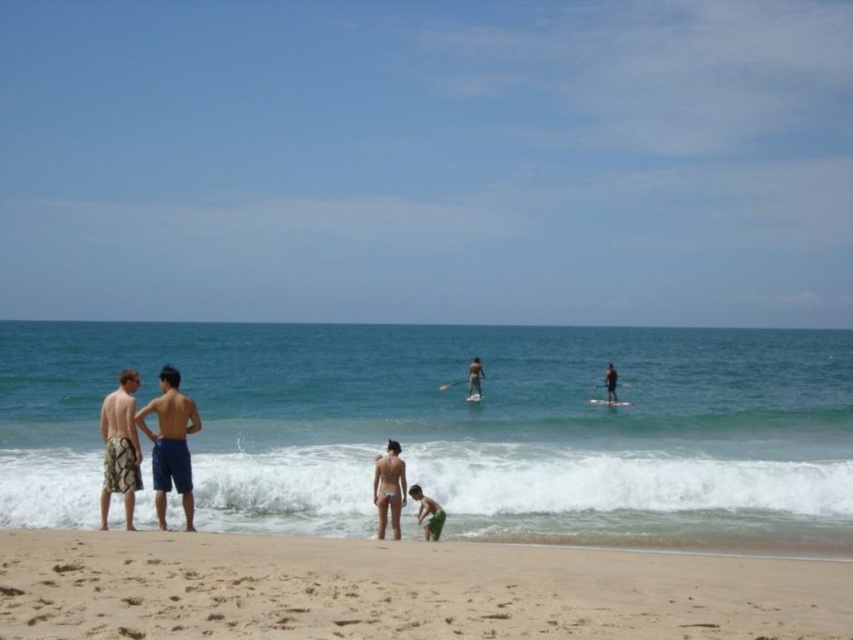
Question: In this image, where is sandy beach at lower center located relative to green cotton shorts at lower center?

Choices:
 (A) below
 (B) above

Answer: (A)

Question: Based on their relative distances, which object is farther from the clear blue water at center?

Choices:
 (A) blue shorts at left
 (B) matte white bikini at center

Answer: (A)

Question: Which point is closer to the camera?

Choices:
 (A) green cotton shorts at lower center
 (B) camouflage shorts at left
 (C) blue shorts at left
 (D) smooth tan surfboard at center

Answer: (B)

Question: From the image, what is the correct spatial relationship of green cotton shorts at lower center in relation to smooth tan surfboard at center?

Choices:
 (A) below
 (B) above

Answer: (A)

Question: Is sandy beach at lower center closer to camera compared to blue shorts at left?

Choices:
 (A) yes
 (B) no

Answer: (A)

Question: Among these objects, which one is nearest to the camera?

Choices:
 (A) sandy beach at lower center
 (B) camouflage shorts at left
 (C) blue shorts at left
 (D) clear blue water at center

Answer: (A)